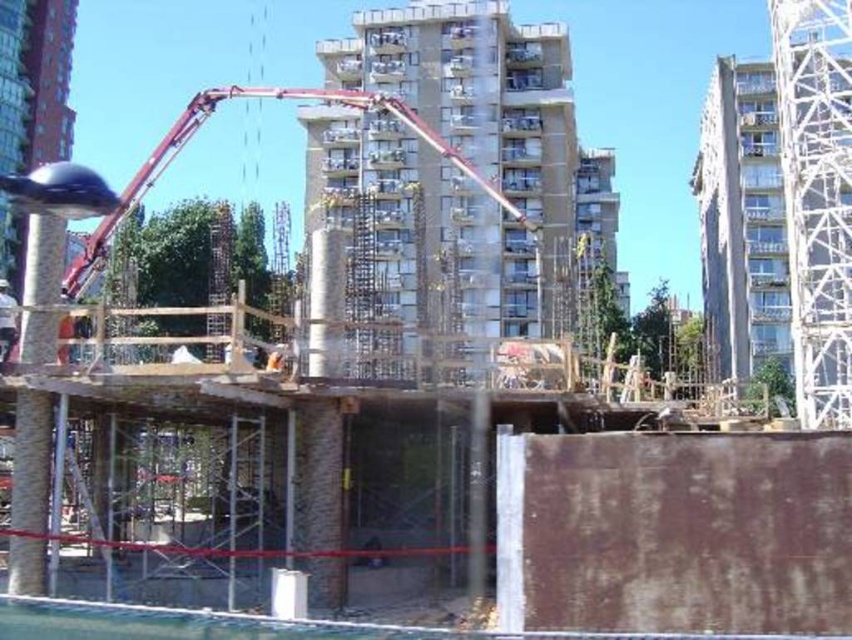
You are a construction worker standing at the entrance of the construction site. You need to move towards the smooth concrete building at right and the metallic red crane at center. Which object will you encounter first as you walk straight ahead?

You will first encounter the smooth concrete building at right because it is closer to you than the metallic red crane at center, which is further away.

You are a construction supervisor observing the site. You see the white metallic tower at upper right and the light brown wooden construction worker at lower left. Which object is positioned higher in the image?

The white metallic tower at upper right is positioned higher than the light brown wooden construction worker at lower left in the image.